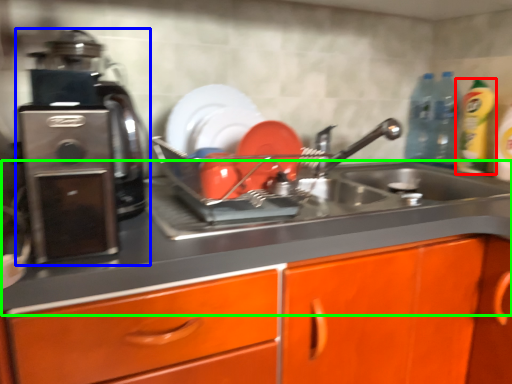
Question: Considering the real-world distances, which object is closest to cleaning product (highlighted by a red box)? home appliance (highlighted by a blue box) or counter top (highlighted by a green box).

Choices:
 (A) home appliance
 (B) counter top

Answer: (B)